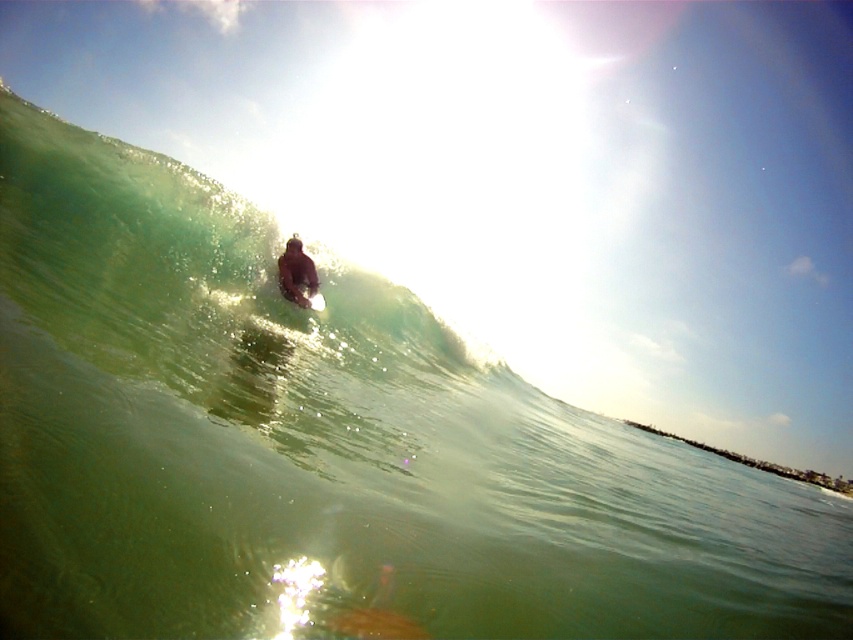
Is brown wetsuit at center taller than white foam surfboard at center?

Yes.

Is point (312, 262) positioned in front of point (310, 307)?

No, (312, 262) is further to viewer.

The height and width of the screenshot is (640, 853). In order to click on brown wetsuit at center in this screenshot , I will do `click(296, 273)`.

From the picture: Which is above, white foam surfboard at center or smooth white surfboard at center?

white foam surfboard at center is above.

From the picture: Who is positioned more to the left, white foam surfboard at center or smooth white surfboard at center?

Positioned to the left is white foam surfboard at center.

The width and height of the screenshot is (853, 640). I want to click on white foam surfboard at center, so click(x=315, y=301).

Is point (306, 282) farther from viewer compared to point (289, 298)?

Yes, point (306, 282) is farther from viewer.

What do you see at coordinates (296, 273) in the screenshot? I see `brown wetsuit at center` at bounding box center [296, 273].

Describe the element at coordinates (296, 273) in the screenshot. I see `brown wetsuit at center` at that location.

Where is `brown wetsuit at center`? brown wetsuit at center is located at coordinates (296, 273).